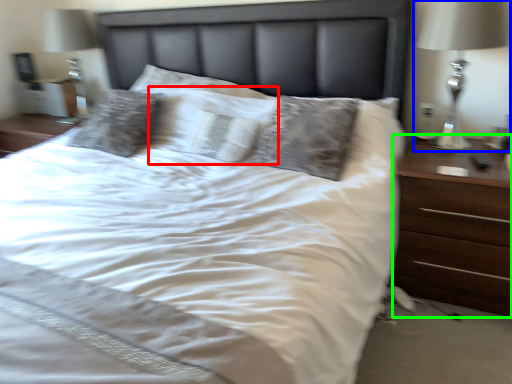
Question: Which is nearer to the pillow (highlighted by a red box)? bedside lamp (highlighted by a blue box) or nightstand (highlighted by a green box).

Choices:
 (A) bedside lamp
 (B) nightstand

Answer: (B)